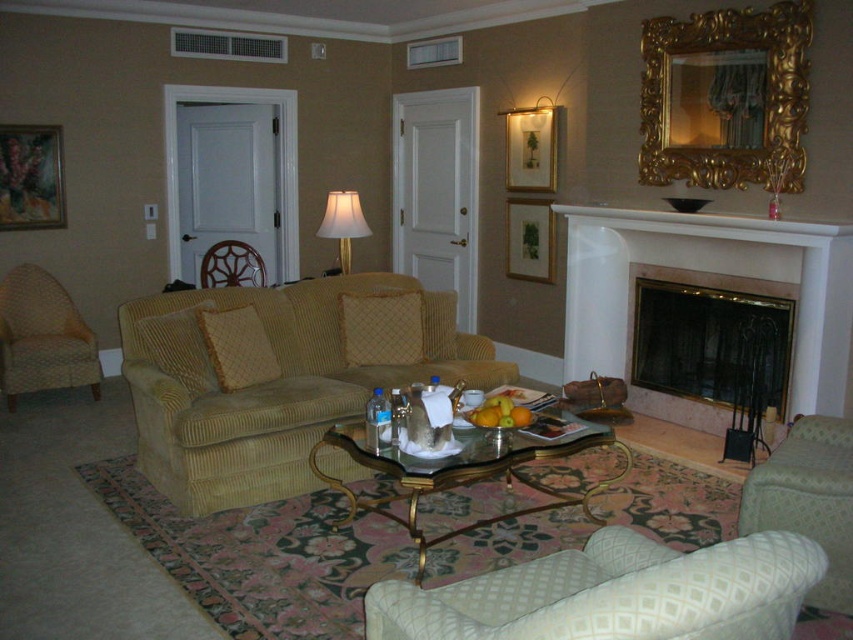
Question: Does beige corduroy couch at center have a greater width compared to green textured armchair at lower right?

Choices:
 (A) no
 (B) yes

Answer: (B)

Question: Which object appears closest to the camera in this image?

Choices:
 (A) green textured armchair at lower right
 (B) white textured armchair at lower right
 (C) rattan armchair at center
 (D) black glass fireplace at center

Answer: (B)

Question: Based on their relative distances, which object is farther from the gold-framed picture at upper center?

Choices:
 (A) beige corduroy armchair at left
 (B) black glass fireplace at center

Answer: (A)

Question: Can you confirm if gold-framed picture at center is wider than rattan armchair at center?

Choices:
 (A) yes
 (B) no

Answer: (B)

Question: Estimate the real-world distances between objects in this image. Which object is farther from the white fabric lampshade at center?

Choices:
 (A) wooden picture frame at upper left
 (B) transparent glass coffee table at center

Answer: (B)

Question: Is green textured armchair at lower right above wooden picture frame at upper left?

Choices:
 (A) yes
 (B) no

Answer: (B)